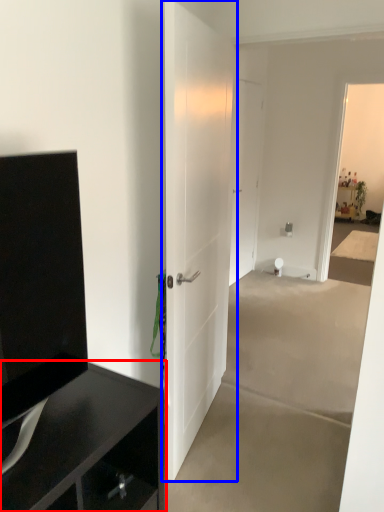
Question: Which object is closer to the camera taking this photo, cabinetry (highlighted by a red box) or door (highlighted by a blue box)?

Choices:
 (A) cabinetry
 (B) door

Answer: (A)